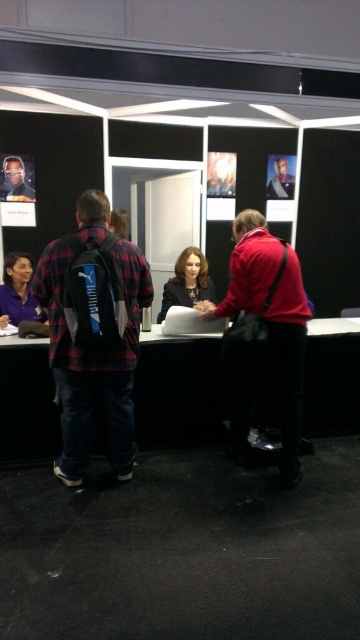
You are a GUI agent. You are given a task and a screenshot of the screen. Output one action in this format:
    pyautogui.click(x=<x>, y=<y>)
    Task: Click on the black glossy table at center
    
    Given the screenshot: What is the action you would take?
    pyautogui.click(x=178, y=390)

Can you confirm if black glossy table at center is thinner than matte black shirt at center?

Incorrect, black glossy table at center's width is not less than matte black shirt at center's.

Who is more forward, (209, 413) or (200, 262)?

Positioned in front is point (209, 413).

This screenshot has width=360, height=640. Find the location of `black glossy table at center`. black glossy table at center is located at coordinates (178, 390).

Consider the image. Between matte red jacket at center and matte black face at upper left, which one is positioned higher?

matte black face at upper left is above.

Is matte red jacket at center wider than matte black face at upper left?

Yes.

Who is more distant from viewer, (199, 305) or (7, 161)?

Point (7, 161)

This screenshot has height=640, width=360. Identify the location of matte red jacket at center. (263, 332).

Does matte black shirt at center have a greater width compared to matte black face at upper left?

Yes.

Which of these two, matte black shirt at center or matte black face at upper left, stands taller?

matte black shirt at center

You are a GUI agent. You are given a task and a screenshot of the screen. Output one action in this format:
    pyautogui.click(x=<x>, y=<y>)
    Task: Click on the matte black shirt at center
    The width and height of the screenshot is (360, 640).
    Given the screenshot: What is the action you would take?
    (186, 282)

Where is `matte black shirt at center`? The width and height of the screenshot is (360, 640). matte black shirt at center is located at coordinates (186, 282).